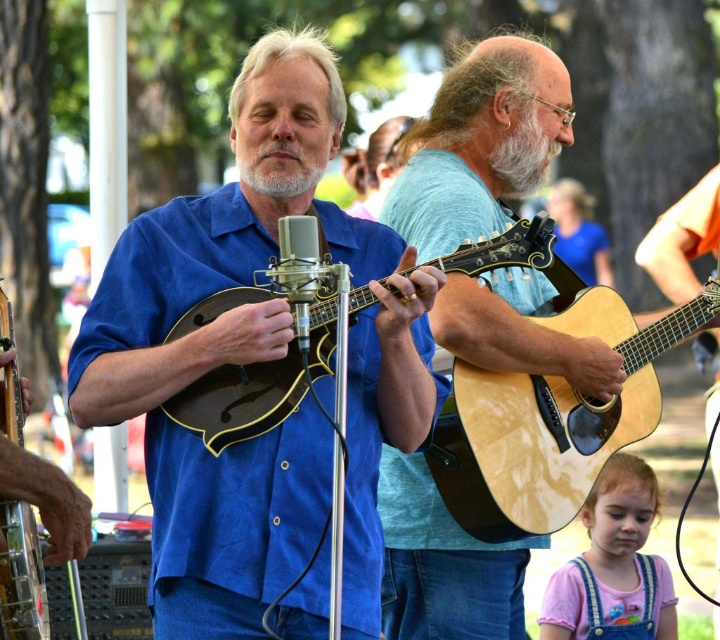
Which is more to the right, pink cotton shirt at lower right or white soft beard at center?

Positioned to the right is pink cotton shirt at lower right.

Who is more forward, (666, 573) or (522, 160)?

Point (522, 160) is in front.

You are a GUI agent. You are given a task and a screenshot of the screen. Output one action in this format:
    pyautogui.click(x=<x>, y=<y>)
    Task: Click on the pink cotton shirt at lower right
    The height and width of the screenshot is (640, 720).
    Given the screenshot: What is the action you would take?
    pyautogui.click(x=613, y=564)

Which is more to the right, matte black mandolin at center or pink cotton shirt at lower right?

From the viewer's perspective, pink cotton shirt at lower right appears more on the right side.

Between point (212, 308) and point (639, 624), which one is positioned behind?

Point (639, 624)

The height and width of the screenshot is (640, 720). I want to click on matte black mandolin at center, so click(x=238, y=401).

Is natural wood acoustic guitar at center positioned behind silver metallic microphone at center?

Yes, natural wood acoustic guitar at center is behind silver metallic microphone at center.

Which is behind, point (456, 520) or point (270, 273)?

Point (456, 520)

Is point (648, 358) in front of point (300, 310)?

No, it is behind (300, 310).

This screenshot has width=720, height=640. I want to click on natural wood acoustic guitar at center, so click(x=549, y=419).